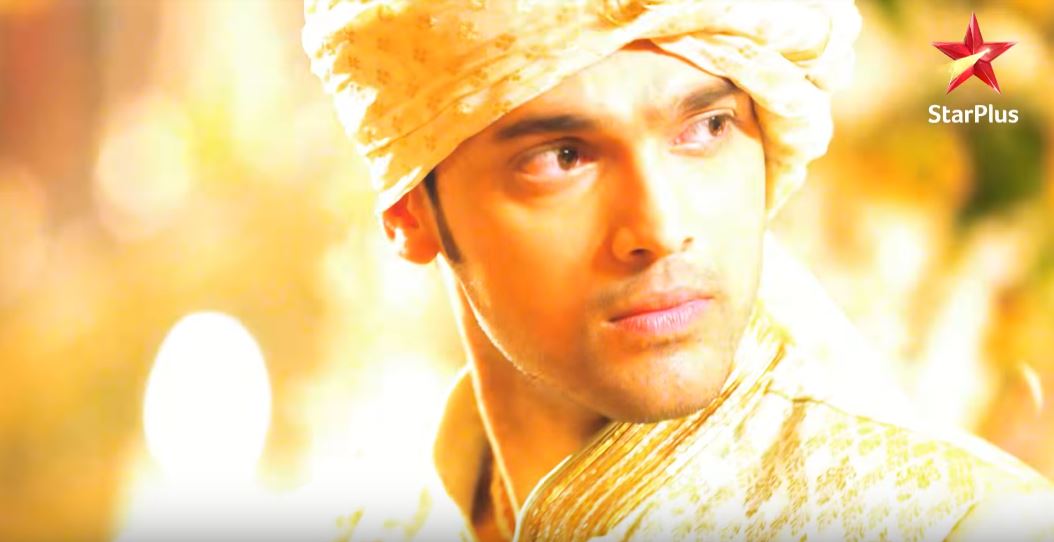
At what (x,y) coordinates should I click in order to perform the action: click on robe. Please return your answer as a coordinate pair (x, y). The width and height of the screenshot is (1054, 542). Looking at the image, I should click on (840, 473).